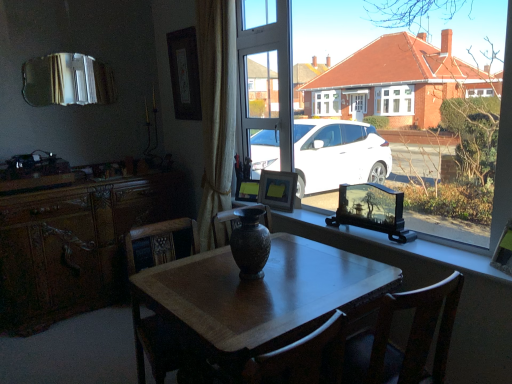
Question: Could you tell me if wooden picture frame at window, arranged as the 1th picture frame when ordered from the bottom, is facing matte brown vase at center?

Choices:
 (A) no
 (B) yes

Answer: (B)

Question: From the image's perspective, is wooden picture frame at window, the fourth picture frame from the top, beneath matte brown vase at center?

Choices:
 (A) yes
 (B) no

Answer: (B)

Question: Are wooden picture frame at window, marked as the fourth picture frame in a back-to-front arrangement, and matte brown vase at center beside each other?

Choices:
 (A) yes
 (B) no

Answer: (B)

Question: Can you confirm if wooden picture frame at window, marked as the fourth picture frame in a back-to-front arrangement, is positioned to the left of matte brown vase at center?

Choices:
 (A) yes
 (B) no

Answer: (B)

Question: Considering the relative sizes of wooden picture frame at window, the 4th picture frame when ordered from left to right, and matte brown vase at center in the image provided, is wooden picture frame at window, the 4th picture frame when ordered from left to right, thinner than matte brown vase at center?

Choices:
 (A) yes
 (B) no

Answer: (A)

Question: Considering the positions of matte black vase at center and wooden chair at center in the image, is matte black vase at center wider or thinner than wooden chair at center?

Choices:
 (A) thin
 (B) wide

Answer: (A)

Question: Is matte black vase at center in front of or behind wooden chair at center in the image?

Choices:
 (A) front
 (B) behind

Answer: (A)

Question: Choose the correct answer: Is matte black vase at center inside wooden chair at center or outside it?

Choices:
 (A) inside
 (B) outside

Answer: (B)

Question: In terms of height, does matte black vase at center look taller or shorter compared to wooden chair at center?

Choices:
 (A) short
 (B) tall

Answer: (B)

Question: From the image's perspective, is matte black vase at center positioned above or below wooden picture frame at window, marked as the fourth picture frame in a back-to-front arrangement?

Choices:
 (A) above
 (B) below

Answer: (A)

Question: Is matte black vase at center wider or thinner than wooden picture frame at window, arranged as the 1th picture frame when ordered from the bottom?

Choices:
 (A) thin
 (B) wide

Answer: (B)

Question: Would you say matte black vase at center is to the left or to the right of wooden picture frame at window, the 4th picture frame when ordered from left to right, in the picture?

Choices:
 (A) right
 (B) left

Answer: (B)

Question: Is point (x=467, y=104) positioned closer to the camera than point (x=506, y=258)?

Choices:
 (A) closer
 (B) farther

Answer: (B)

Question: From a real-world perspective, relative to matte black picture frame at center, marked as the 3th picture frame in a front-to-back arrangement, is silver reflective mirror at upper left vertically above or below?

Choices:
 (A) above
 (B) below

Answer: (A)

Question: Is silver reflective mirror at upper left wider or thinner than matte black picture frame at center, the second picture frame viewed from the back?

Choices:
 (A) wide
 (B) thin

Answer: (B)